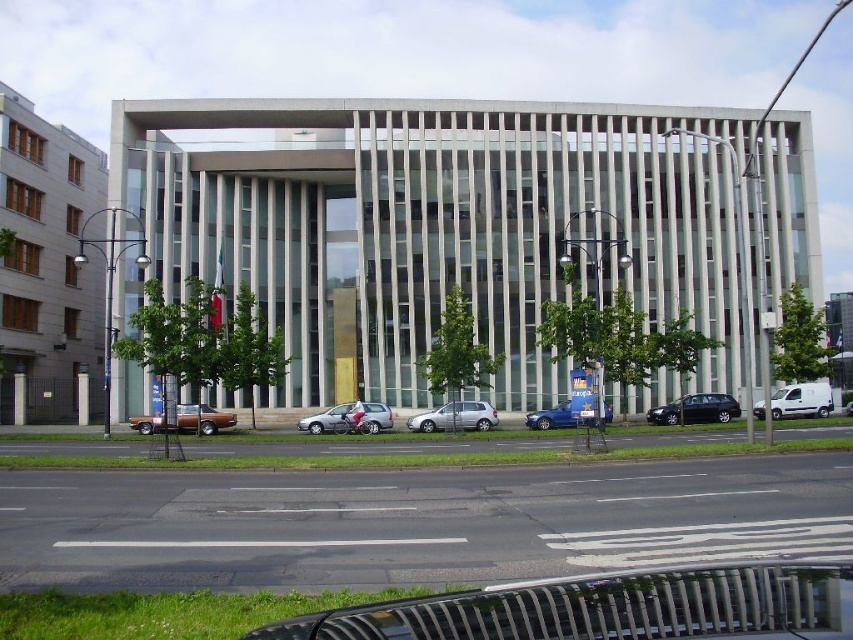
Can you confirm if shiny brown car at lower left is shorter than metallic blue sedan at center?

Yes.

Locate an element on the screen. shiny brown car at lower left is located at coordinates (201, 419).

You are a GUI agent. You are given a task and a screenshot of the screen. Output one action in this format:
    pyautogui.click(x=<x>, y=<y>)
    Task: Click on the shiny brown car at lower left
    Image resolution: width=853 pixels, height=640 pixels.
    Given the screenshot: What is the action you would take?
    pyautogui.click(x=201, y=419)

Can you confirm if metallic gray station wagon at center-right is positioned above metallic blue sedan at center?

No, metallic gray station wagon at center-right is not above metallic blue sedan at center.

Is metallic gray station wagon at center-right closer to the viewer compared to metallic blue sedan at center?

No, metallic gray station wagon at center-right is further to the viewer.

This screenshot has width=853, height=640. What do you see at coordinates (695, 410) in the screenshot? I see `metallic gray station wagon at center-right` at bounding box center [695, 410].

You are a GUI agent. You are given a task and a screenshot of the screen. Output one action in this format:
    pyautogui.click(x=<x>, y=<y>)
    Task: Click on the metallic gray station wagon at center-right
    Image resolution: width=853 pixels, height=640 pixels.
    Given the screenshot: What is the action you would take?
    [695, 410]

Who is more forward, (722, 417) or (757, 403)?

Point (722, 417)

Based on the photo, is metallic gray station wagon at center-right below white matte van at right?

Correct, metallic gray station wagon at center-right is located below white matte van at right.

This screenshot has height=640, width=853. Describe the element at coordinates (695, 410) in the screenshot. I see `metallic gray station wagon at center-right` at that location.

Image resolution: width=853 pixels, height=640 pixels. Find the location of `metallic gray station wagon at center-right`. metallic gray station wagon at center-right is located at coordinates (695, 410).